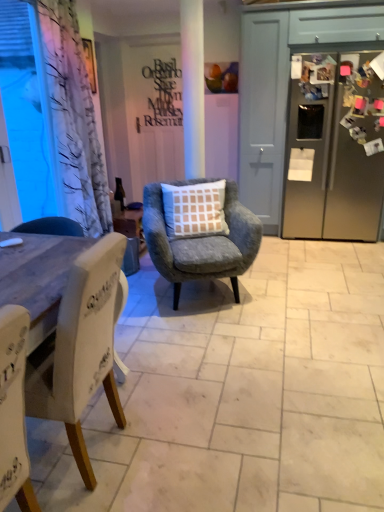
Find the location of a particular element. The image size is (384, 512). vacant location below white fabric chair at left, the 2th chair positioned from the back (from a real-world perspective) is located at coordinates (87, 444).